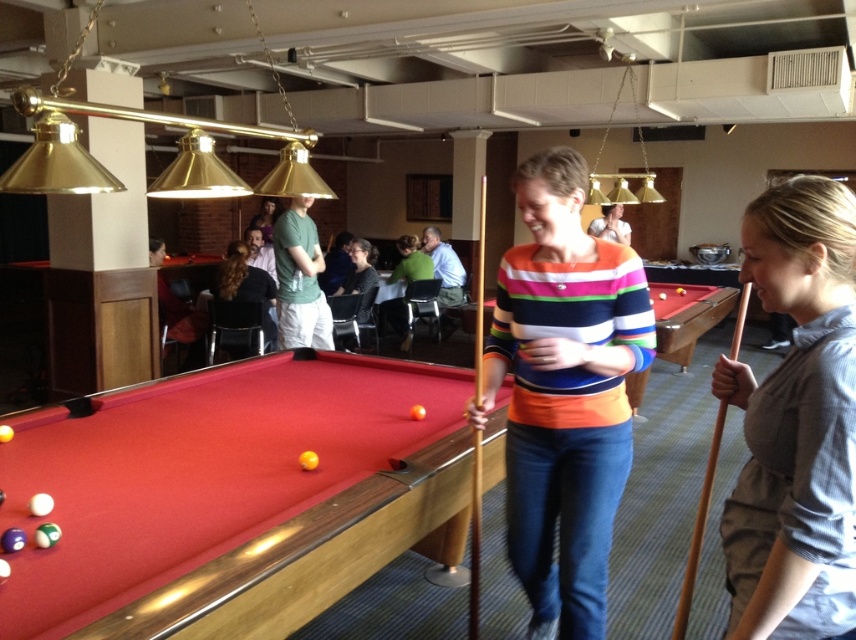
You are a photographer standing at the back of the room. You want to take a photo of the striped cotton sweater at center and the rubberized felt pool table at center. Can you frame both objects in the same shot without moving the camera?

The rubberized felt pool table at center is below the striped cotton sweater at center, so yes, you can frame both in the same shot as they are vertically aligned.

You are a delivery person who needs to place a large package on the floor near the rubberized felt pool table at center and the striped cotton sweater at center. Considering their sizes, which object should you avoid placing the package too close to?

You should avoid placing the package too close to the rubberized felt pool table at center because it has a larger size compared to the striped cotton sweater at center, so it requires more space.

You are a photographer standing at the entrance of the recreational area. You want to capture a photo that includes both the striped cotton sweater at center and the wooden at right. Given their sizes, which object should you focus on to ensure both are in frame without needing to zoom in or out?

The striped cotton sweater at center is much taller than the wooden at right, so you should focus on the striped cotton sweater at center to ensure both are in frame without needing to adjust the zoom.